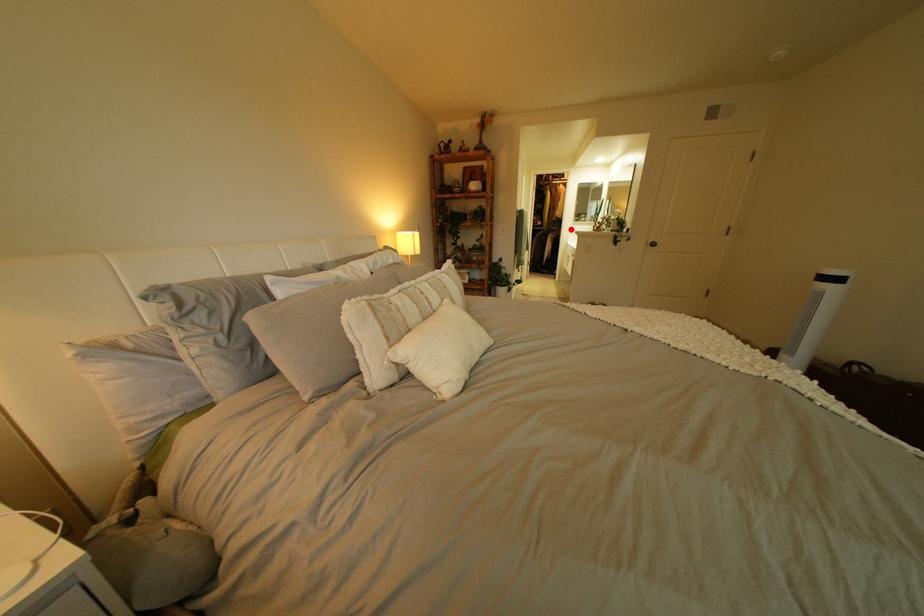
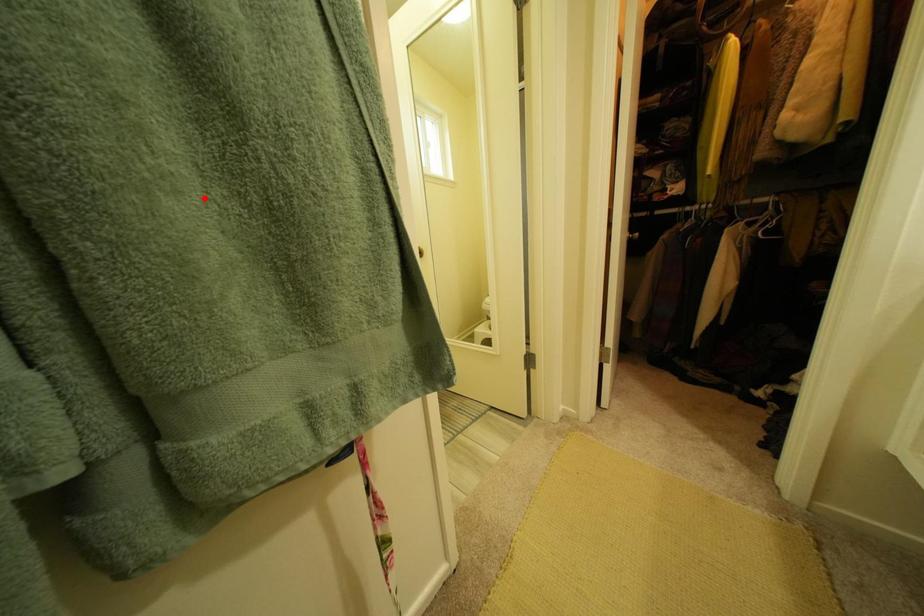
I am providing you with two images of the same scene from different viewpoints. A red point is marked on the first image and another point is marked on the second image. Does the point marked in image1 correspond to the same location as the one in image2?

No